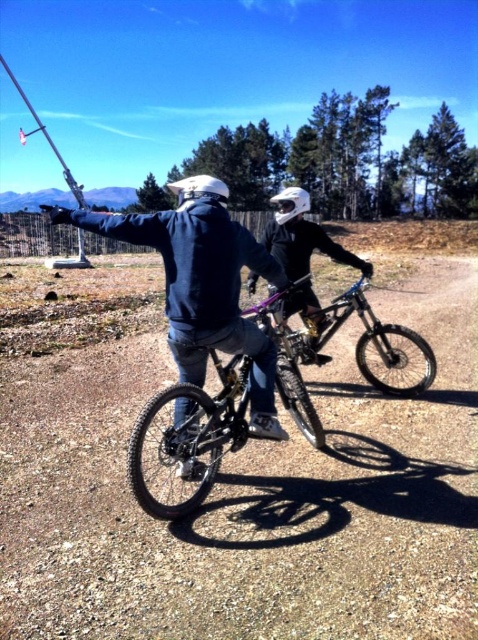
You are a drone operator trying to capture a photo of the shiny black bicycle at center. The camera is currently positioned at point A. To frame the bicycle perfectly in the center of the photo, should you move the camera to the left or right? Please explain your reasoning based on the bicycle location coordinates provided.

The shiny black bicycle at center is located at coordinates point A at [193,435]. Since the camera is already positioned at point A, which is the same as the bicycle location, no movement is needed. The bicycle is already centered in the photo.